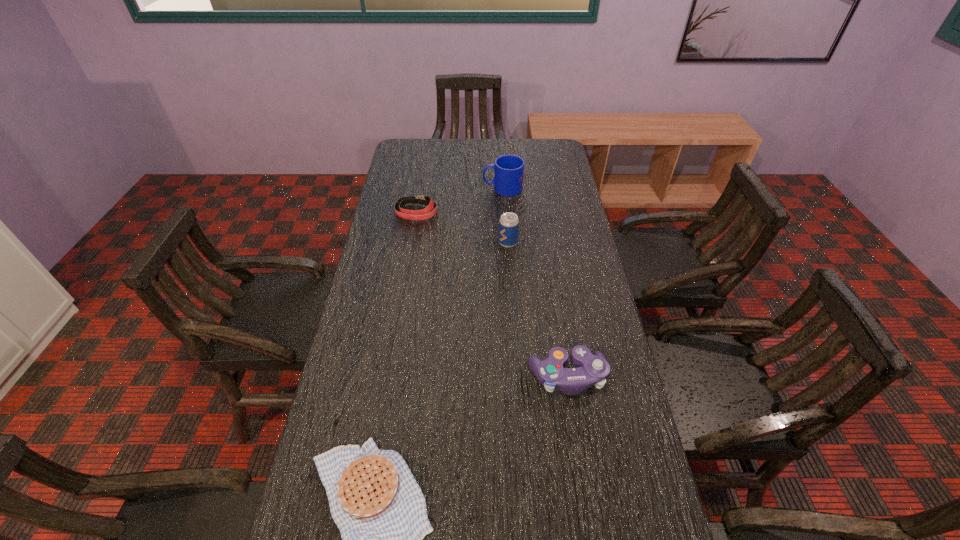
The height and width of the screenshot is (540, 960). I want to click on vacant space located on the back of the second farthest object, so click(x=426, y=154).

You are a GUI agent. You are given a task and a screenshot of the screen. Output one action in this format:
    pyautogui.click(x=<x>, y=<y>)
    Task: Click on the object present at the left edge
    This screenshot has width=960, height=540.
    Given the screenshot: What is the action you would take?
    pyautogui.click(x=423, y=214)

At what (x,y) coordinates should I click in order to perform the action: click on object situated at the right edge. Please return your answer as a coordinate pair (x, y). This screenshot has width=960, height=540. Looking at the image, I should click on (593, 369).

Find the location of a particular element. This screenshot has width=960, height=540. vacant region at the far edge of the desktop is located at coordinates (447, 149).

Locate an element on the screen. The width and height of the screenshot is (960, 540). vacant space at the left edge of the desktop is located at coordinates (404, 300).

The height and width of the screenshot is (540, 960). What are the coordinates of `vacant area at the right edge of the desktop` in the screenshot? It's located at (636, 518).

Locate an element on the screen. free spot at the far left corner of the desktop is located at coordinates (400, 161).

This screenshot has height=540, width=960. I want to click on vacant space at the far right corner, so click(x=538, y=143).

Find the location of `free space between the third shortest object and the third nearest object`. free space between the third shortest object and the third nearest object is located at coordinates (538, 310).

Find the location of `unoccupied position between the fourth farthest object and the beer can`. unoccupied position between the fourth farthest object and the beer can is located at coordinates (538, 310).